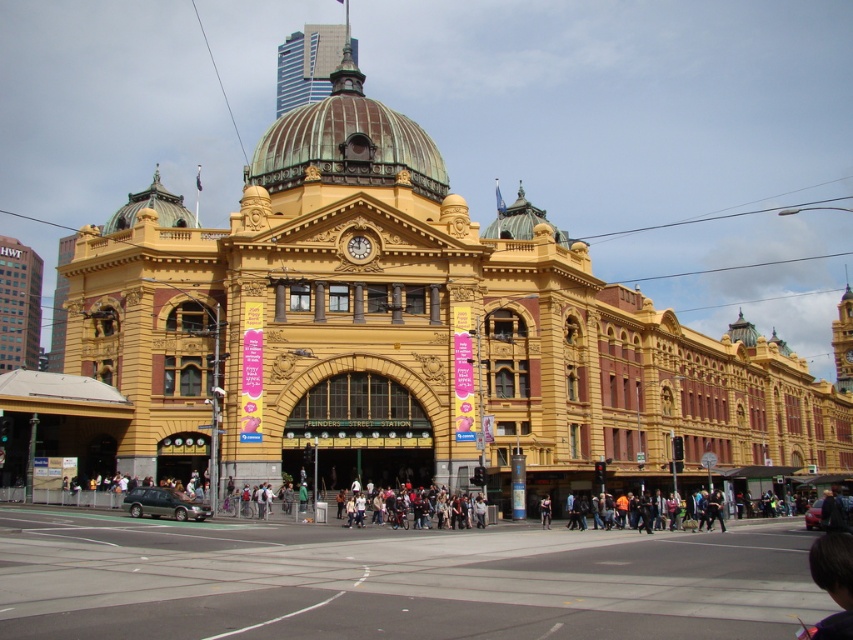
Which is in front, point (291, 113) or point (392, 504)?

Point (392, 504) is more forward.

Who is lower down, green copper dome at center or matte black backpack at center?

Positioned lower is matte black backpack at center.

Does point (428, 186) come farther from viewer compared to point (437, 524)?

Yes, it is behind point (437, 524).

Find the location of a particular element. The width and height of the screenshot is (853, 640). green copper dome at center is located at coordinates (347, 141).